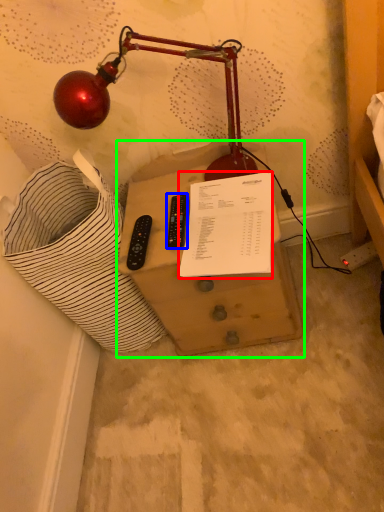
Question: Estimate the real-world distances between objects in this image. Which object is closer to document (highlighted by a red box), control (highlighted by a blue box) or furniture (highlighted by a green box)?

Choices:
 (A) control
 (B) furniture

Answer: (A)